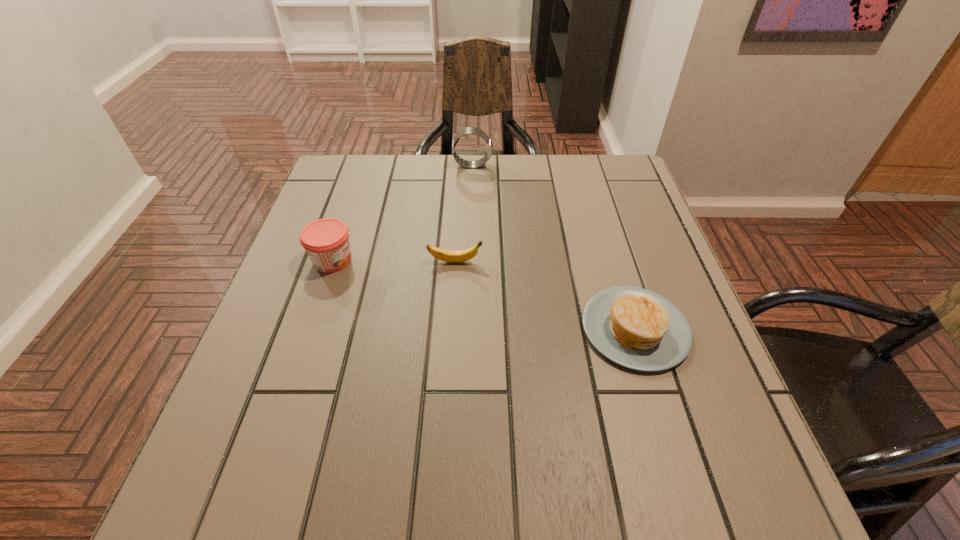
This screenshot has height=540, width=960. I want to click on free space between the banana and the third shortest object, so click(394, 261).

Locate which object is the second closest to the rightmost object. Please provide its 2D coordinates. Your answer should be formatted as a tuple, i.e. [(x, y)], where the tuple contains the x and y coordinates of a point satisfying the conditions above.

[(326, 241)]

Choose which object is the second nearest neighbor to the watch. Please provide its 2D coordinates. Your answer should be formatted as a tuple, i.e. [(x, y)], where the tuple contains the x and y coordinates of a point satisfying the conditions above.

[(326, 241)]

The width and height of the screenshot is (960, 540). I want to click on free space in the image that satisfies the following two spatial constraints: 1. on the front label of the nearest object; 2. on the right side of the jam, so click(310, 329).

At what (x,y) coordinates should I click in order to perform the action: click on vacant space that satisfies the following two spatial constraints: 1. on the back side of the rightmost object; 2. on the face of the farthest object. Please return your answer as a coordinate pair (x, y). The width and height of the screenshot is (960, 540). Looking at the image, I should click on (586, 165).

Find the location of `free space that satisfies the following two spatial constraints: 1. on the front label of the pancake; 2. on the left side of the leftmost object`. free space that satisfies the following two spatial constraints: 1. on the front label of the pancake; 2. on the left side of the leftmost object is located at coordinates (310, 329).

Locate an element on the screen. The image size is (960, 540). vacant area in the image that satisfies the following two spatial constraints: 1. on the back side of the nearest object; 2. on the front label of the leftmost object is located at coordinates (614, 260).

Identify the location of free space that satisfies the following two spatial constraints: 1. on the face of the watch; 2. on the left side of the pancake. The width and height of the screenshot is (960, 540). (468, 329).